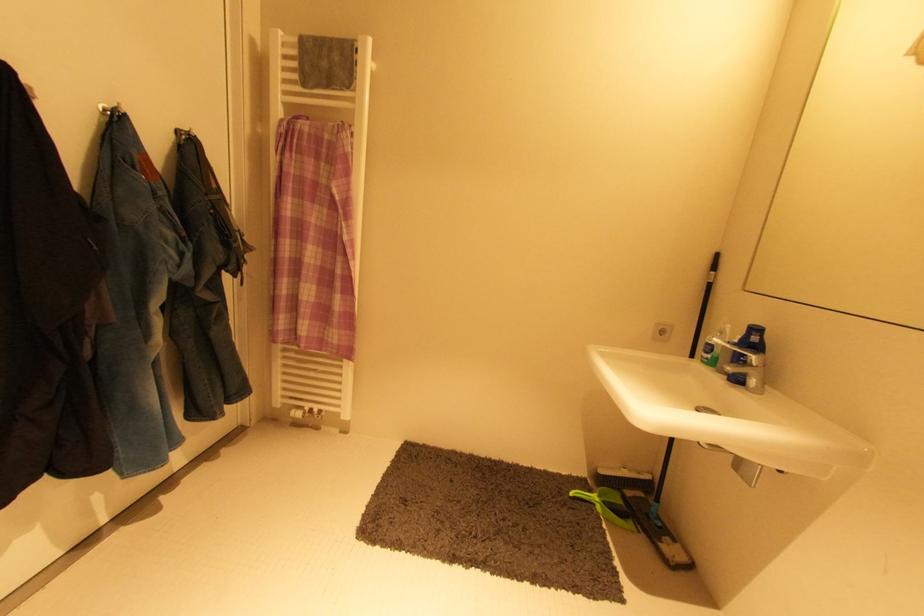
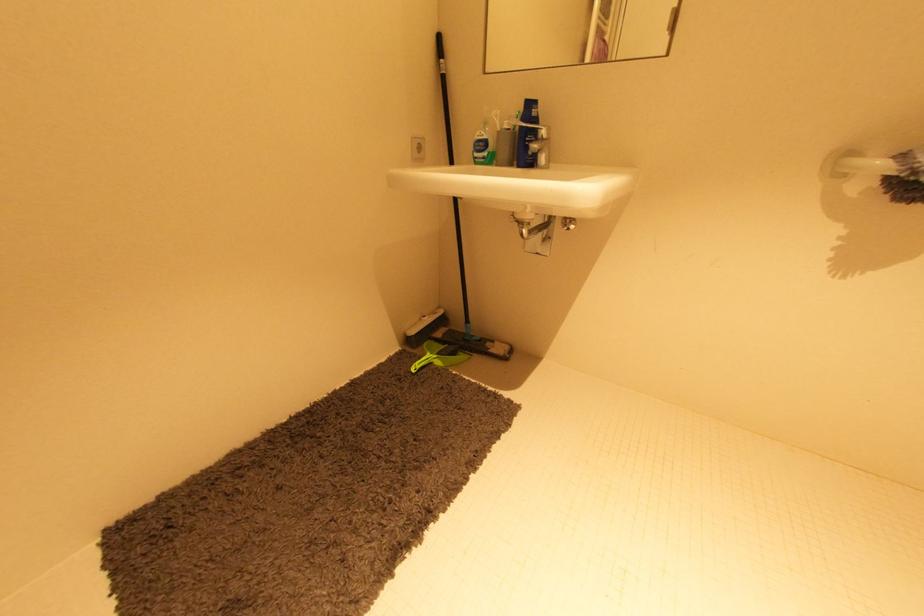
How did the camera likely rotate?

The rotation direction of the camera is right-down.